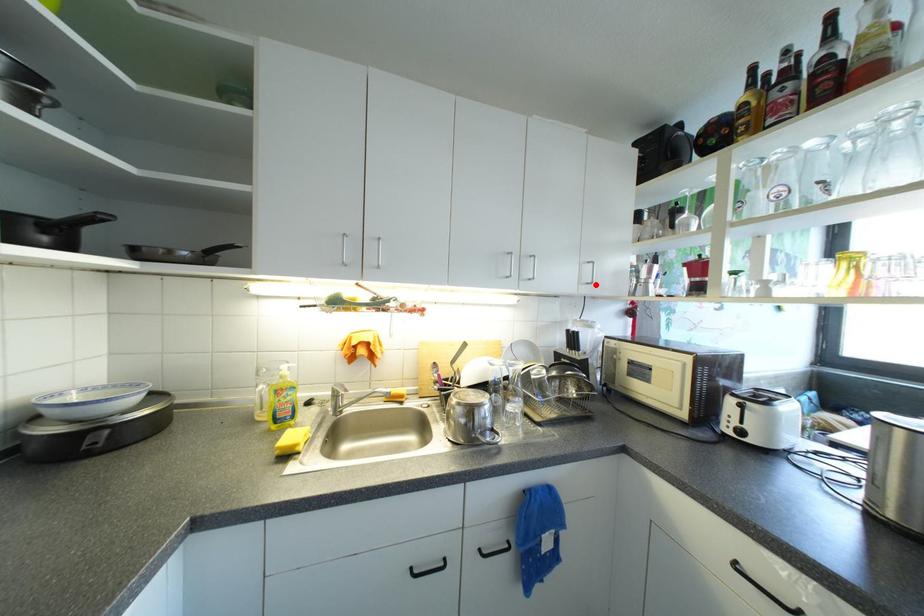
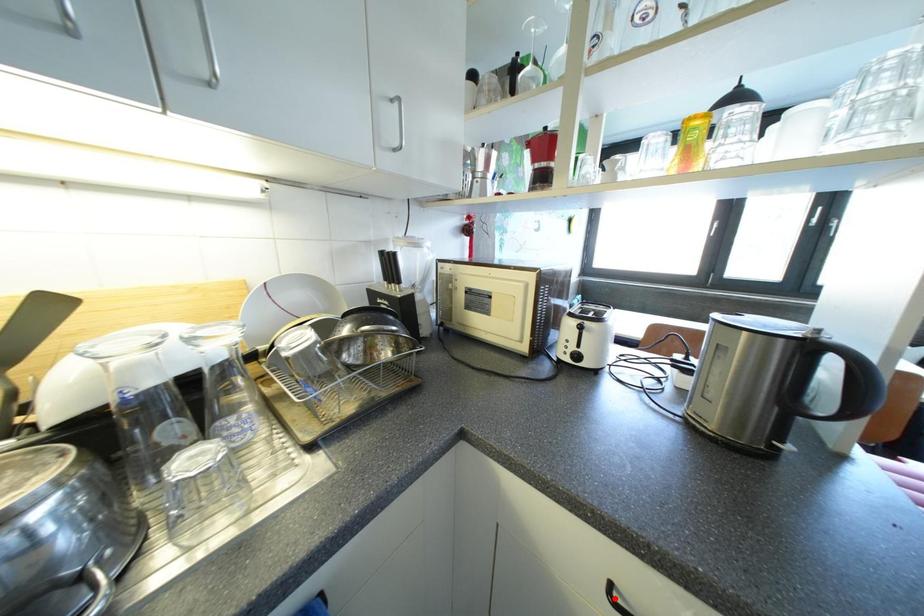
I am providing you with two images of the same scene from different viewpoints. A red point is marked on the first image and another point is marked on the second image. Does the point marked in image1 correspond to the same location as the one in image2?

No